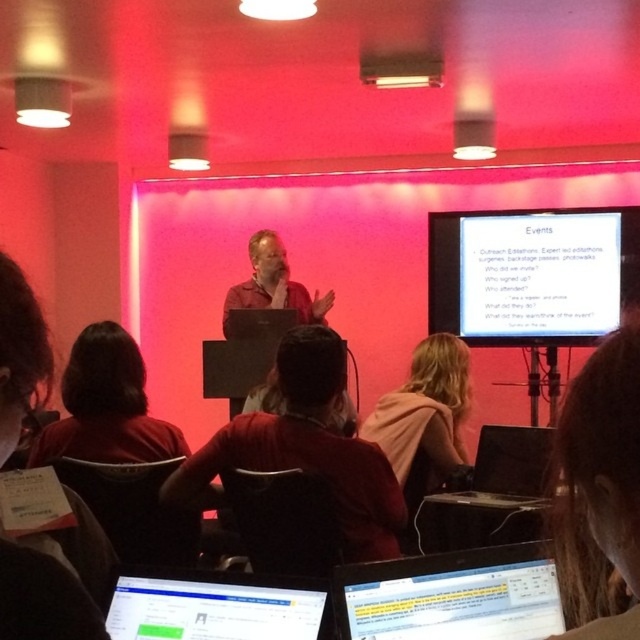
You are organizing a tech conference and need to set up two laptops for presentations. The matte black laptop at lower center and the black plastic laptop at center are available. Based on their sizes, which laptop can you place on a standard conference table that requires the laptop to be at least 10 cm in height?

The black plastic laptop at center is taller than the matte black laptop at lower center. Since the standard conference table requires the laptop to be at least 10 cm in height, the black plastic laptop at center meets the height requirement and can be placed on the table.

You are a photographer adjusting your camera settings to capture the presentation. You notice two points in the scene at coordinates point (116,339) and point (268,272). Which point should you focus on to ensure the closest object in the scene is sharply captured?

Point (116,339) is closer to the camera than point (268,272), so you should focus on point (116,339) to ensure the closest object is sharply captured.